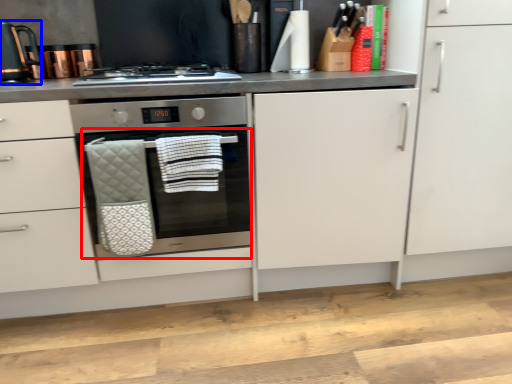
Question: Which of the following is the farthest to the observer, oven (highlighted by a red box) or kitchen appliance (highlighted by a blue box)?

Choices:
 (A) oven
 (B) kitchen appliance

Answer: (B)